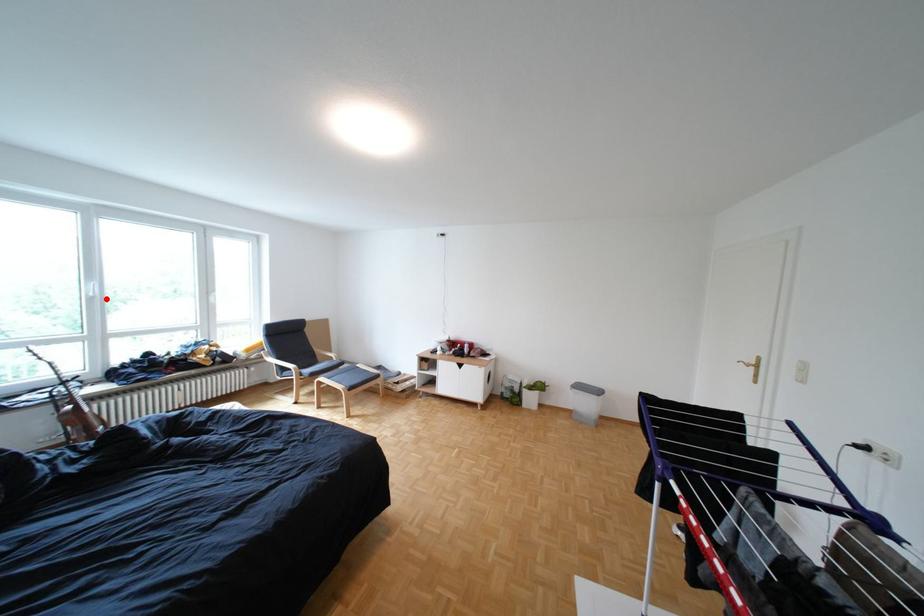
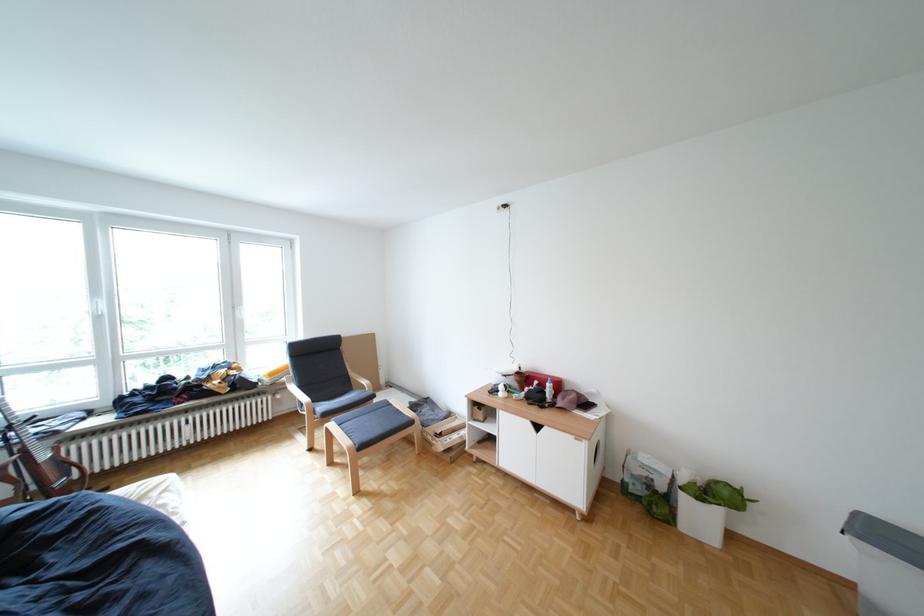
Locate, in the second image, the point that corresponds to the highlighted location in the first image.

(114, 318)